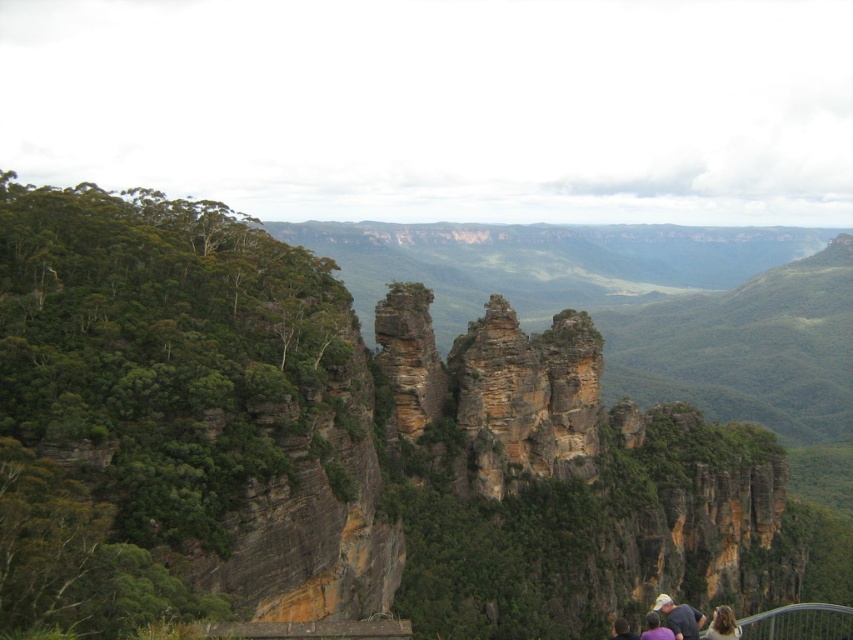
Is point (473, 467) closer to camera compared to point (613, 636)?

No, (473, 467) is behind (613, 636).

Is rugged stone rock formation at center further to camera compared to dark brown hair at lower right?

Yes.

Is point (395, 289) less distant than point (624, 628)?

No, it is behind (624, 628).

In order to click on rugged stone rock formation at center in this screenshot , I will do `click(496, 387)`.

Looking at this image, can you confirm if rugged rock formation at center is positioned to the right of blonde hair at lower right?

No, rugged rock formation at center is not to the right of blonde hair at lower right.

Does rugged rock formation at center appear over blonde hair at lower right?

Correct, rugged rock formation at center is located above blonde hair at lower right.

This screenshot has width=853, height=640. I want to click on rugged rock formation at center, so (337, 445).

This screenshot has width=853, height=640. Identify the location of rugged rock formation at center. (337, 445).

Does rugged stone rock formation at center have a lesser width compared to metal/rusty rail at lower right?

Indeed, rugged stone rock formation at center has a lesser width compared to metal/rusty rail at lower right.

Looking at this image, who is positioned more to the right, rugged stone rock formation at center or metal/rusty rail at lower right?

metal/rusty rail at lower right is more to the right.

Is point (473, 400) more distant than point (782, 620)?

No, it is not.

Find the location of a particular element. rugged stone rock formation at center is located at coordinates (496, 387).